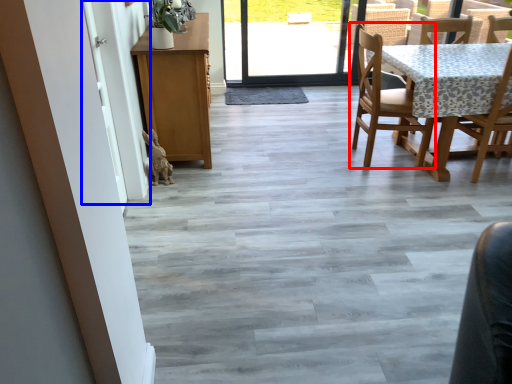
Question: Which object is closer to the camera taking this photo, chair (highlighted by a red box) or screen door (highlighted by a blue box)?

Choices:
 (A) chair
 (B) screen door

Answer: (B)